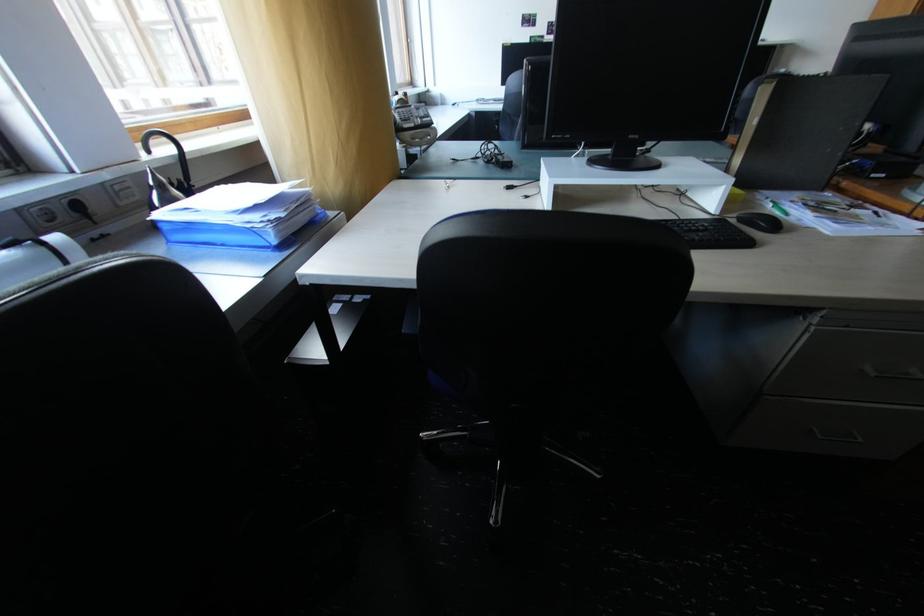
Where would you slid the blue paper tray? Please return your answer as a coordinate pair (x, y).

(237, 215)